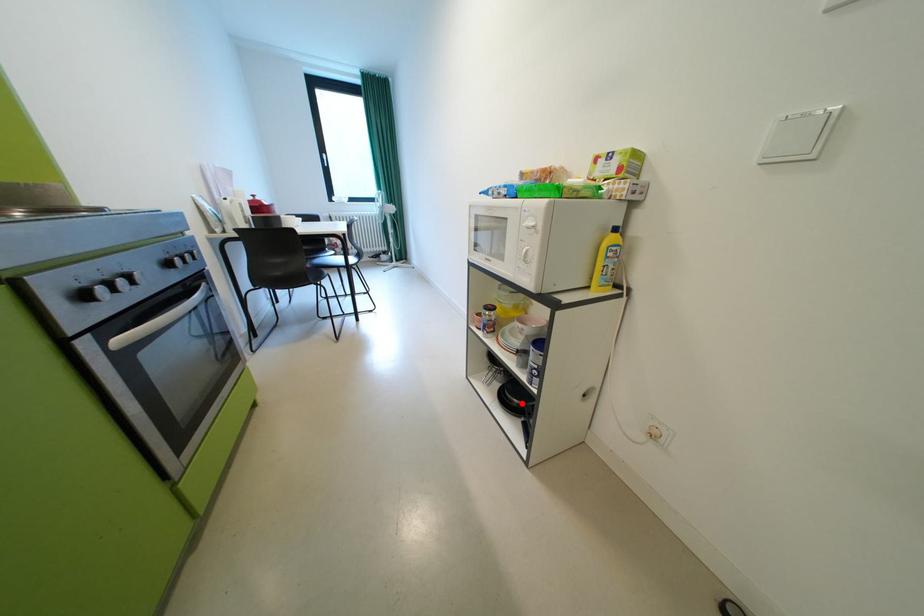
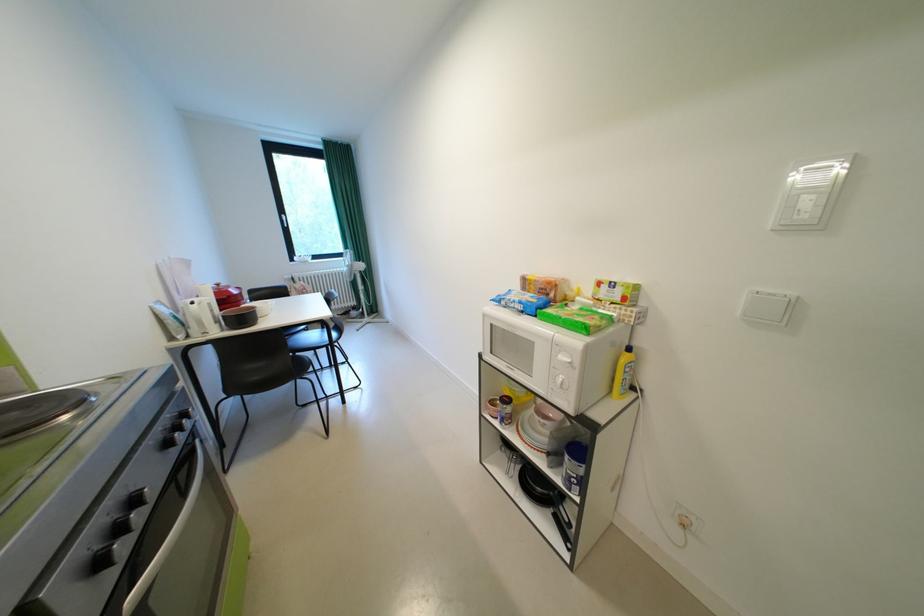
Question: A red point is marked in image1. In image2, is the corresponding 3D point closer to the camera or farther? Reply with the corresponding letter.

Choices:
 (A) The corresponding 3D point is closer.
 (B) The corresponding 3D point is farther.

Answer: (B)